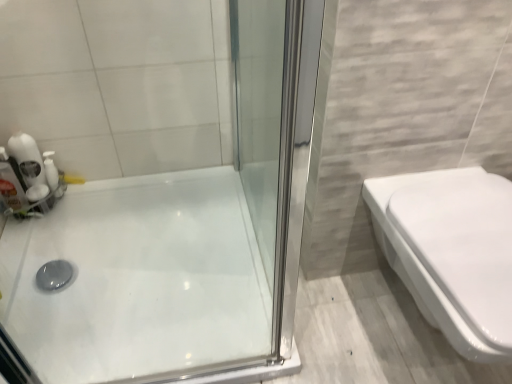
This screenshot has width=512, height=384. What are the coordinates of `white glossy toilet at right` in the screenshot? It's located at (454, 252).

The height and width of the screenshot is (384, 512). What do you see at coordinates (454, 252) in the screenshot?
I see `white glossy toilet at right` at bounding box center [454, 252].

In order to click on white glossy toilet at right in this screenshot , I will do `click(454, 252)`.